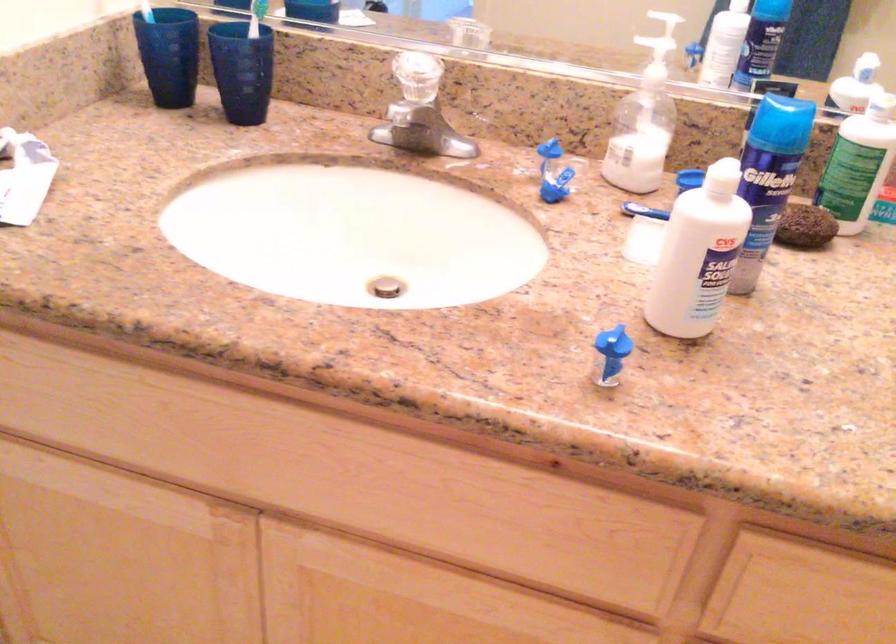
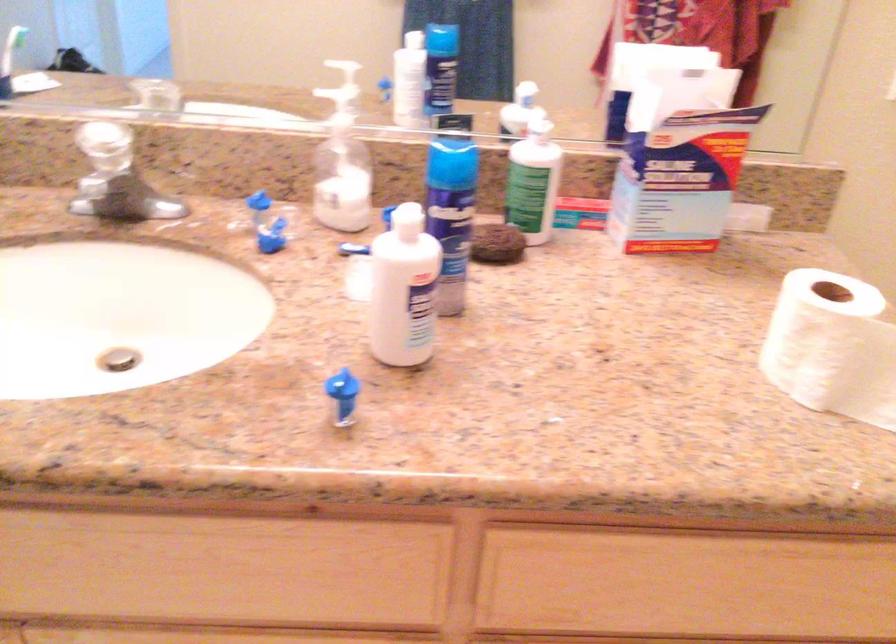
Locate, in the second image, the point that corresponds to [701,254] in the first image.

(403, 289)